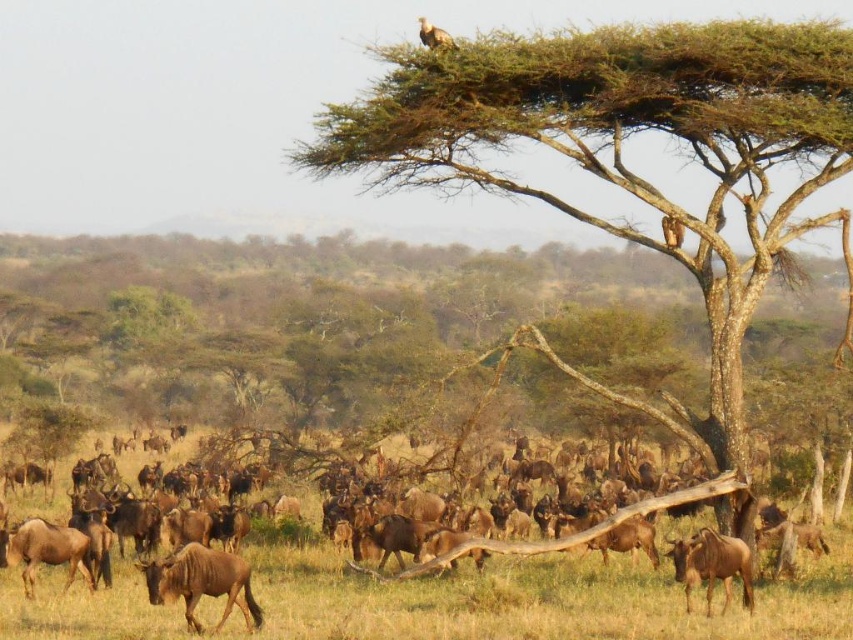
You are a photographer trying to capture the brown matte glossy wildebeest at lower left. The camera is positioned at the point marked by the coordinate point [202,582]. Will the wildebeest be in the frame of the photo?

The point [202,582] marks the brown matte glossy wildebeest at lower left, so yes, the wildebeest will be in the frame of the photo.

You are a photographer trying to capture a clear shot of the brown textured tree at upper center without the brown dry grass at center obstructing the view. Based on their positions, can you position yourself in a way that the tree is in the foreground and the grass is out of the frame?

The brown dry grass at center is behind the brown textured tree at upper center, so positioning yourself so the tree is in the foreground would naturally block the grass from appearing in the shot.